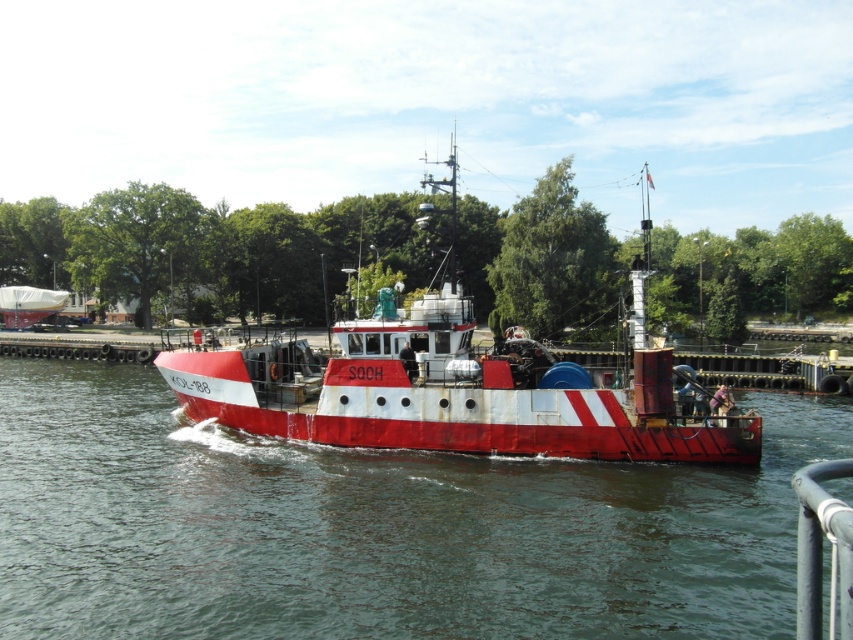
Question: Does smooth water at center have a greater width compared to white tarpaulin boat at left?

Choices:
 (A) yes
 (B) no

Answer: (A)

Question: Which of the following is the closest to the observer?

Choices:
 (A) rusty metal boat at center
 (B) smooth water at center

Answer: (B)

Question: Is rusty metal boat at center to the left of white tarpaulin boat at left from the viewer's perspective?

Choices:
 (A) no
 (B) yes

Answer: (A)

Question: Which object is the farthest from the white tarpaulin boat at left?

Choices:
 (A) smooth water at center
 (B) rusty metal boat at center

Answer: (A)

Question: Which of the following is the farthest from the observer?

Choices:
 (A) (706, 544)
 (B) (532, 444)
 (C) (27, 292)

Answer: (C)

Question: Does smooth water at center have a smaller size compared to white tarpaulin boat at left?

Choices:
 (A) yes
 (B) no

Answer: (A)